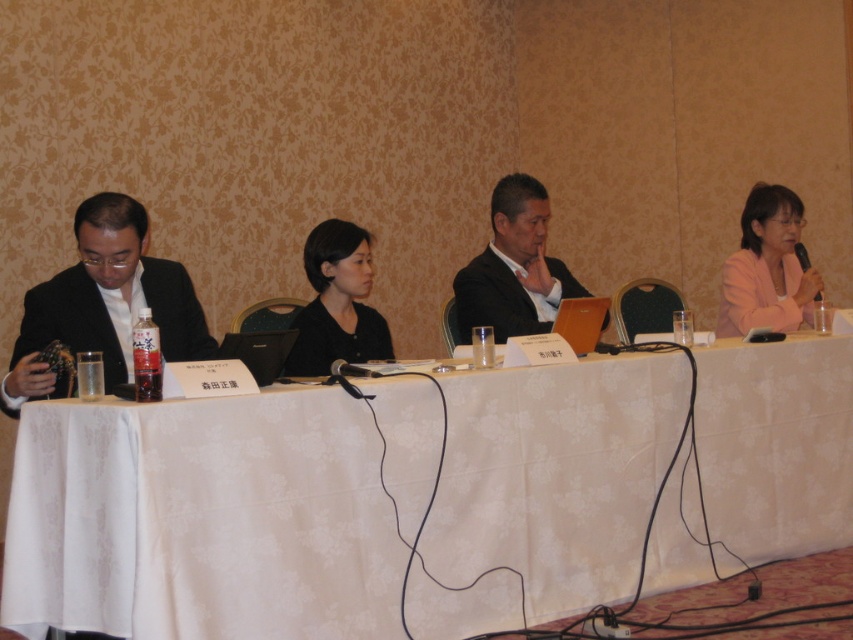
Does point (758, 188) come in front of point (303, 312)?

No, it is behind (303, 312).

Looking at this image, who is more distant from viewer, [740,321] or [312,243]?

Point [740,321]

Which is behind, point (756, 196) or point (335, 340)?

Point (756, 196)

Find the location of `pink fabric jacket at upper right`. pink fabric jacket at upper right is located at coordinates (767, 268).

Who is shorter, white fabric table at center or matte black suit at center?

matte black suit at center

In the scene shown: Is white fabric table at center above matte black suit at center?

No, white fabric table at center is not above matte black suit at center.

Is point (122, 534) in front of point (473, 307)?

Yes, it is in front of point (473, 307).

Where is `white fabric table at center`? white fabric table at center is located at coordinates (202, 518).

Is point (74, 216) behind point (735, 333)?

No, (74, 216) is in front of (735, 333).

Between matte black suit at left and pink fabric jacket at upper right, which one is positioned lower?

matte black suit at left is lower down.

Between point (120, 321) and point (750, 228), which one is positioned behind?

Point (750, 228)

Identify the location of matte black suit at left. (103, 304).